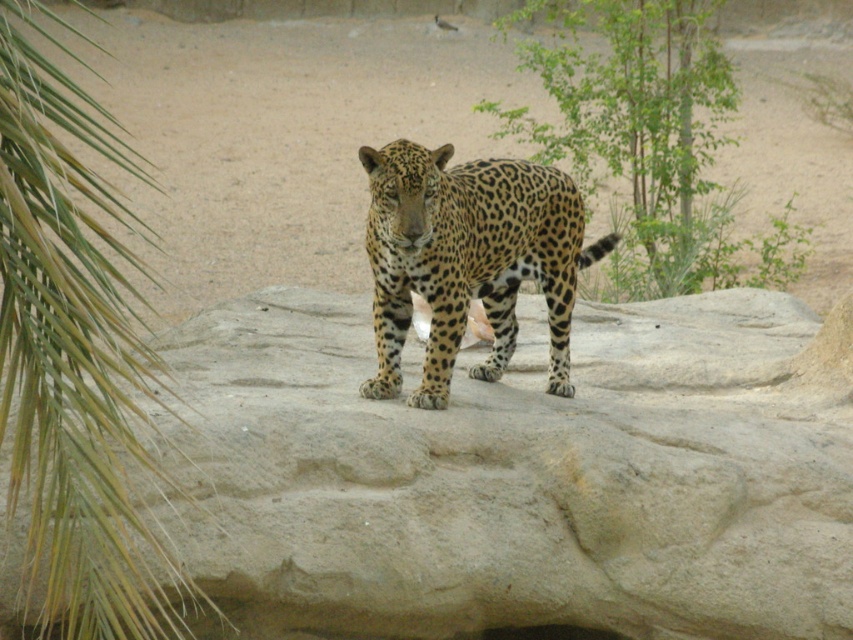
You are a photographer trying to capture the leopard on the rock. You notice two green leafy plants in the background. Which one is taller, the green leafy palm at left or the green leafy tree at upper right?

The green leafy palm at left is taller than the green leafy tree at upper right according to the description.

From the picture: You are a photographer trying to capture the spotted fur leopard at center. You notice a green leafy palm at left in the frame. Which object occupies more horizontal space in the image?

The green leafy palm at left occupies more horizontal space in the image because its width is larger than that of the spotted fur leopard at center.